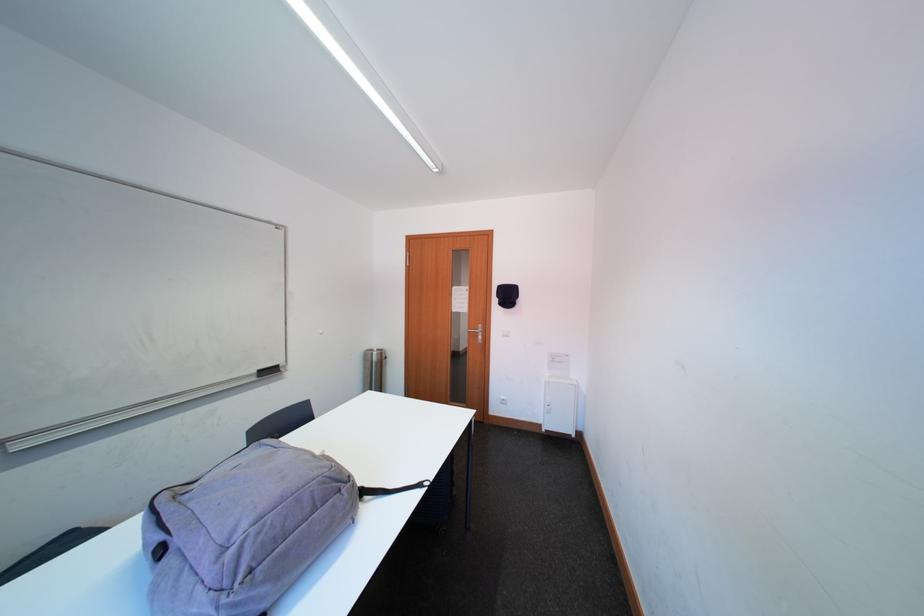
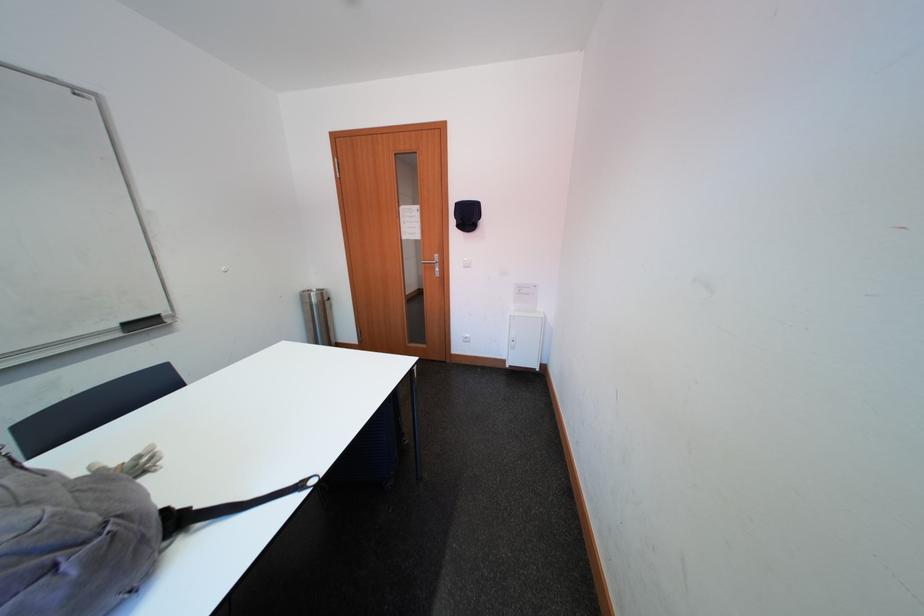
What movement of the cameraman would produce the second image?

The cameraman moved toward right, forward.